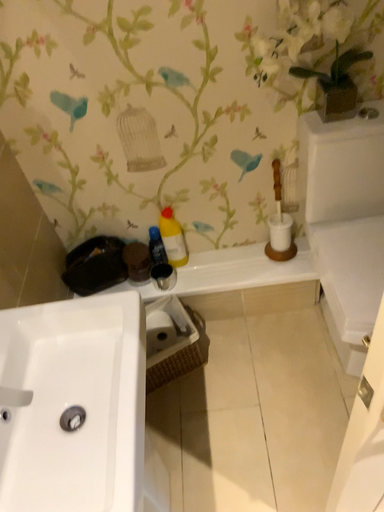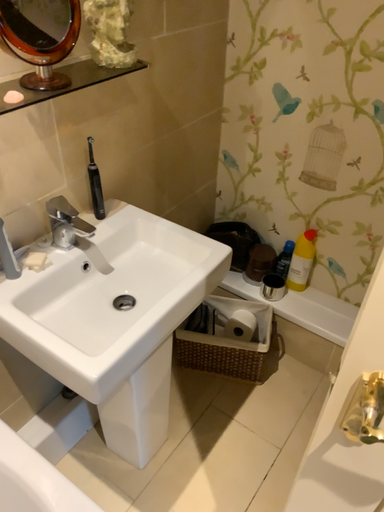
Question: Which way did the camera rotate in the video?

Choices:
 (A) rotated left
 (B) rotated right

Answer: (A)